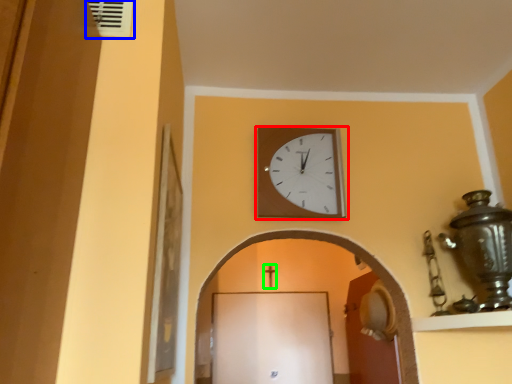
Question: Based on their relative distances, which object is nearer to wall clock (highlighted by a red box)? Choose from air conditioning (highlighted by a blue box) and crucifix (highlighted by a green box).

Choices:
 (A) air conditioning
 (B) crucifix

Answer: (A)